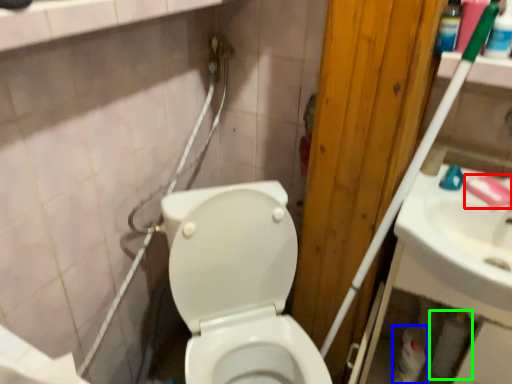
Question: Based on their relative distances, which object is farther from soap (highlighted by a red box)? Choose from cleaning product (highlighted by a blue box) and toilet paper (highlighted by a green box).

Choices:
 (A) cleaning product
 (B) toilet paper

Answer: (A)